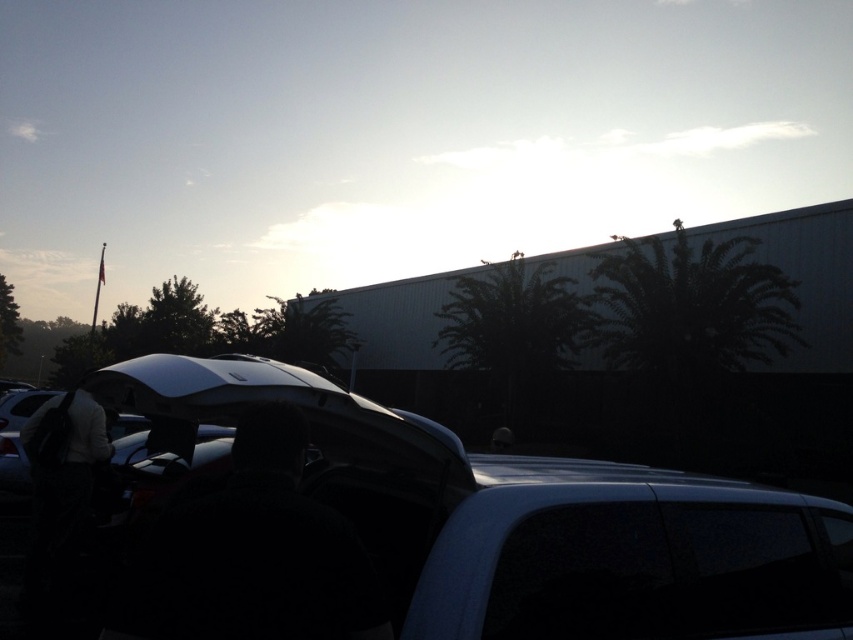
Question: Is the position of glossy black car at center less distant than that of black fabric at center?

Choices:
 (A) yes
 (B) no

Answer: (B)

Question: Is the position of glossy black car at center less distant than that of black fabric at center?

Choices:
 (A) yes
 (B) no

Answer: (B)

Question: Which of the following is the farthest from the observer?

Choices:
 (A) glossy black car at center
 (B) black fabric at center

Answer: (A)

Question: Is glossy black car at center positioned in front of black fabric at center?

Choices:
 (A) yes
 (B) no

Answer: (B)

Question: Which point is farther from the camera taking this photo?

Choices:
 (A) coord(360,582)
 (B) coord(310,561)

Answer: (A)

Question: Among these objects, which one is nearest to the camera?

Choices:
 (A) black fabric at center
 (B) glossy black car at center

Answer: (A)